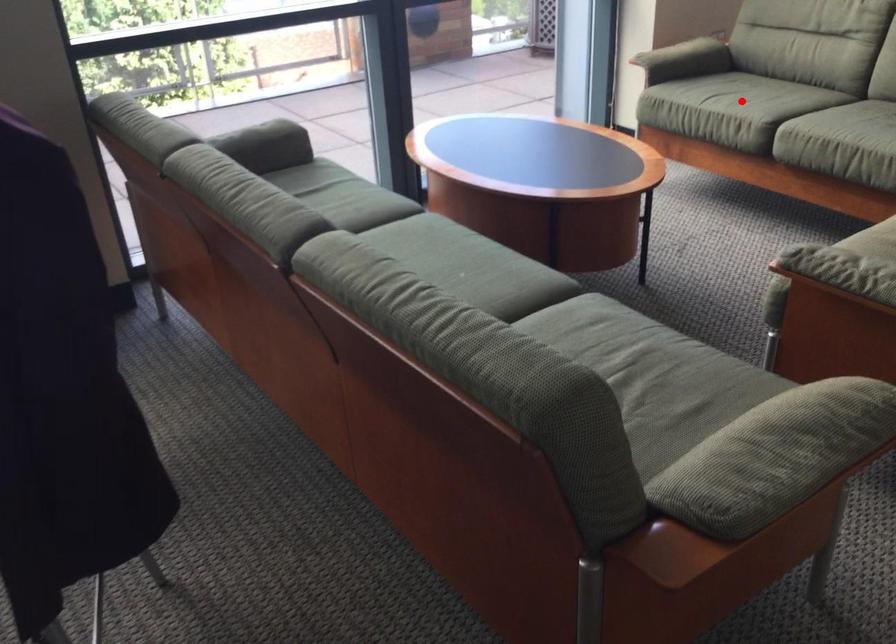
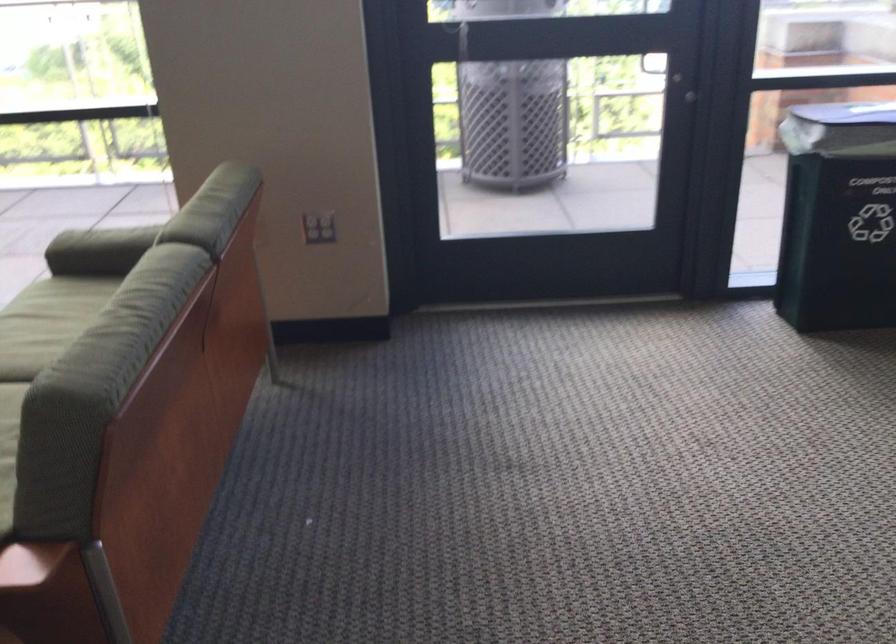
In the second image, find the point that corresponds to the highlighted location in the first image.

(46, 323)